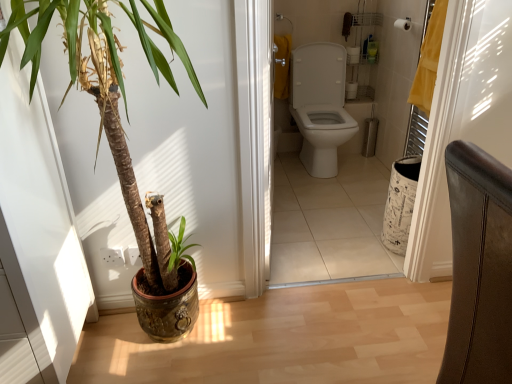
The width and height of the screenshot is (512, 384). I want to click on vacant area situated below green glossy plant at left (from a real-world perspective), so click(152, 352).